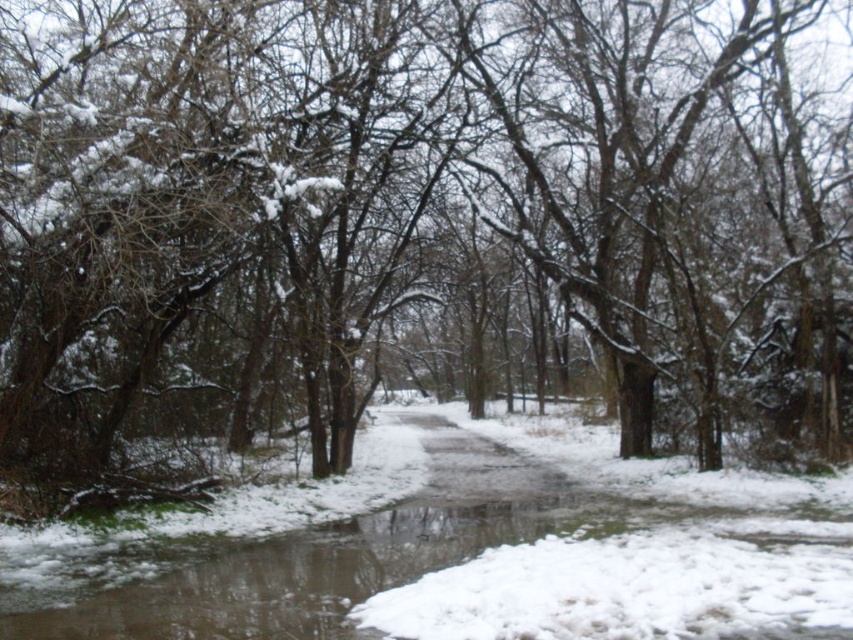
Question: Is frozen water at center to the left of glossy asphalt path at center from the viewer's perspective?

Choices:
 (A) yes
 (B) no

Answer: (B)

Question: Among these objects, which one is nearest to the camera?

Choices:
 (A) glossy asphalt path at center
 (B) frozen water at center

Answer: (B)

Question: Which of the following is the closest to the observer?

Choices:
 (A) frozen water at center
 (B) glossy asphalt path at center

Answer: (A)

Question: Does frozen water at center have a greater width compared to glossy asphalt path at center?

Choices:
 (A) no
 (B) yes

Answer: (B)

Question: Which object is farther from the camera taking this photo?

Choices:
 (A) glossy asphalt path at center
 (B) frozen water at center

Answer: (A)

Question: Observing the image, what is the correct spatial positioning of frozen water at center in reference to glossy asphalt path at center?

Choices:
 (A) right
 (B) left

Answer: (A)